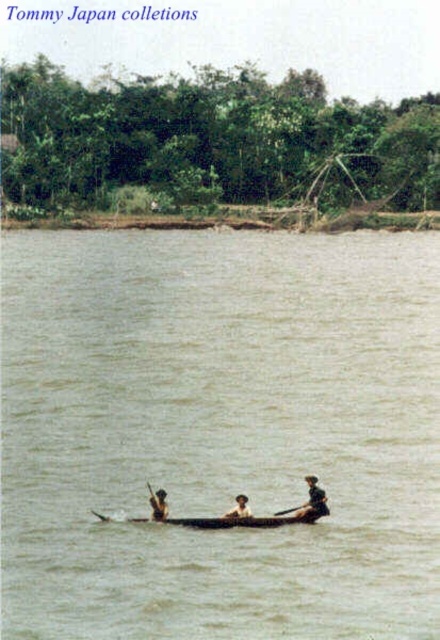
You are a tourist in a boat and you see the brown wooden canoe at center and the wooden paddle at center. Which object is located more to the left?

The brown wooden canoe at center is positioned on the left side of wooden paddle at center, so it is more to the left.